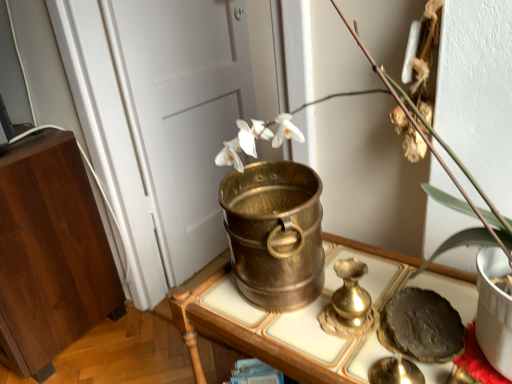
What are the coordinates of `vacant space to the left of shiny dark plate at lower right` in the screenshot? It's located at (318, 333).